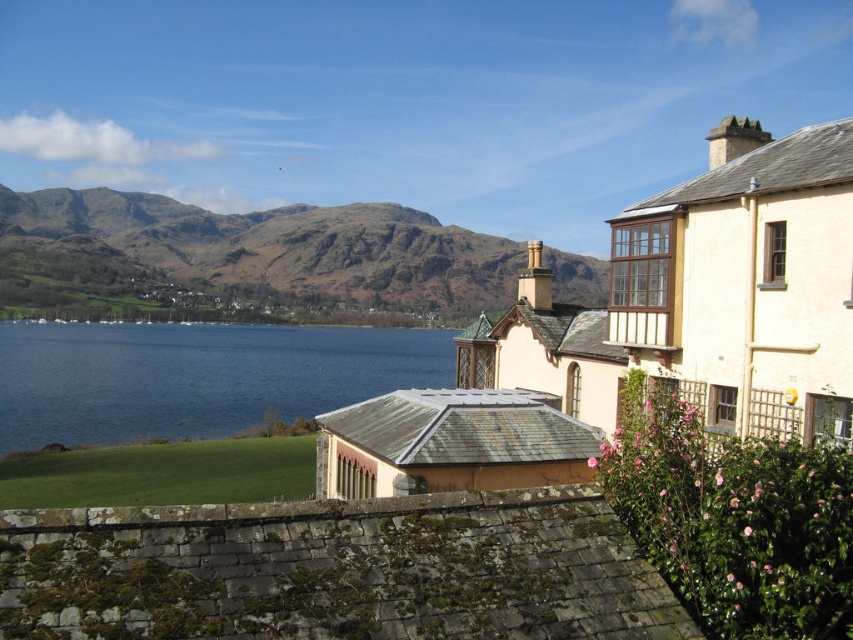
Who is shorter, brown rocky mountain at upper left or blue water at lower left?

Answer: With less height is blue water at lower left.

Is brown rocky mountain at upper left shorter than blue water at lower left?

No.

In order to click on brown rocky mountain at upper left in this screenshot , I will do `click(242, 260)`.